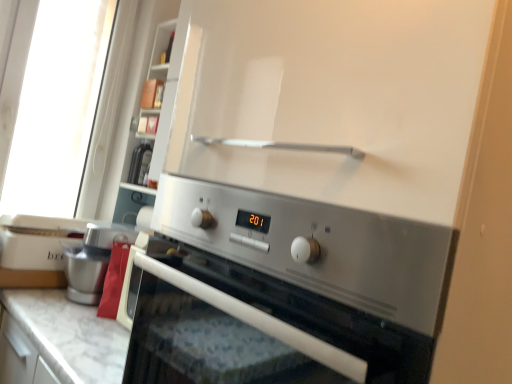
Question: Is white marble countertop at lower center taller than white plastic toaster at left?

Choices:
 (A) yes
 (B) no

Answer: (A)

Question: Is white plastic toaster at left completely or partially inside white marble countertop at lower center?

Choices:
 (A) yes
 (B) no

Answer: (B)

Question: Is white marble countertop at lower center closer to camera compared to white plastic toaster at left?

Choices:
 (A) no
 (B) yes

Answer: (B)

Question: Is white marble countertop at lower center bigger than white plastic toaster at left?

Choices:
 (A) yes
 (B) no

Answer: (A)

Question: Considering the relative sizes of white marble countertop at lower center and white plastic toaster at left in the image provided, is white marble countertop at lower center wider than white plastic toaster at left?

Choices:
 (A) no
 (B) yes

Answer: (B)

Question: Are white marble countertop at lower center and white plastic toaster at left beside each other?

Choices:
 (A) yes
 (B) no

Answer: (B)

Question: From a real-world perspective, is satin silver oven at center below white plastic toaster at left?

Choices:
 (A) yes
 (B) no

Answer: (B)

Question: Is the position of satin silver oven at center more distant than that of white plastic toaster at left?

Choices:
 (A) yes
 (B) no

Answer: (B)

Question: Would you say satin silver oven at center contains white plastic toaster at left?

Choices:
 (A) yes
 (B) no

Answer: (B)

Question: Can you confirm if satin silver oven at center is taller than white plastic toaster at left?

Choices:
 (A) no
 (B) yes

Answer: (B)

Question: Is satin silver oven at center next to white plastic toaster at left?

Choices:
 (A) yes
 (B) no

Answer: (B)

Question: Is satin silver oven at center bigger than white plastic toaster at left?

Choices:
 (A) no
 (B) yes

Answer: (B)

Question: Could you tell me if white plastic toaster at left is facing satin silver oven at center?

Choices:
 (A) yes
 (B) no

Answer: (B)